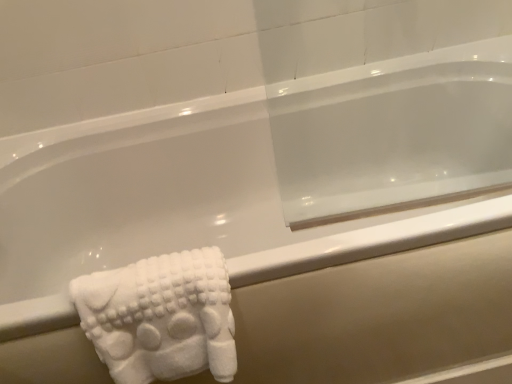
What do you see at coordinates (161, 317) in the screenshot?
I see `white fluffy towel at lower left` at bounding box center [161, 317].

Measure the distance between white fluffy towel at lower left and camera.

white fluffy towel at lower left is 24.27 inches from camera.

You are a GUI agent. You are given a task and a screenshot of the screen. Output one action in this format:
    pyautogui.click(x=<x>, y=<y>)
    Task: Click on the white fluffy towel at lower left
    This screenshot has height=384, width=512.
    Given the screenshot: What is the action you would take?
    pyautogui.click(x=161, y=317)

Locate an element on the screen. white fluffy towel at lower left is located at coordinates (161, 317).